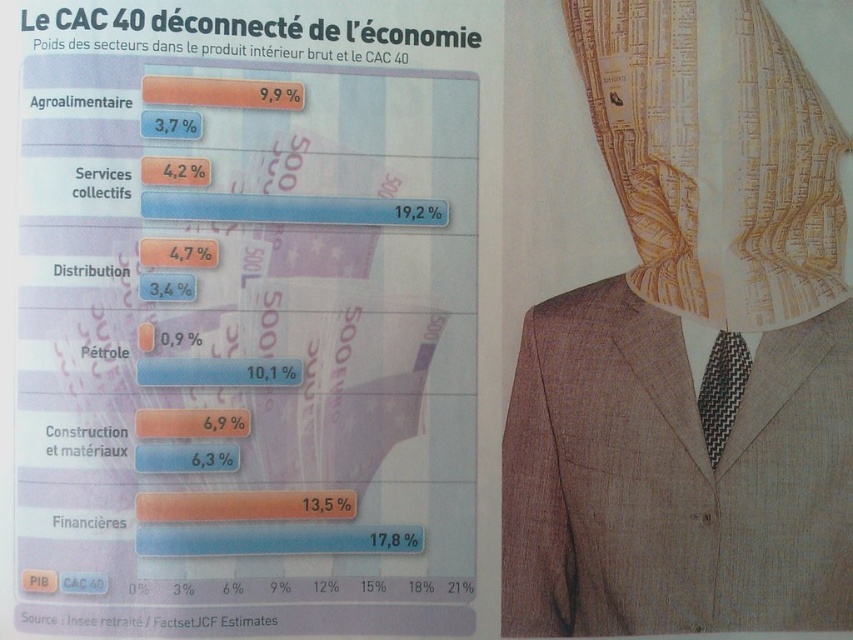
Is light brown textured suit at right closer to camera compared to black checkered tie at center?

Yes.

Between light brown textured suit at right and black checkered tie at center, which one appears on the left side from the viewer's perspective?

light brown textured suit at right

What do you see at coordinates (689, 348) in the screenshot? I see `light brown textured suit at right` at bounding box center [689, 348].

At what (x,y) coordinates should I click in order to perform the action: click on light brown textured suit at right. Please return your answer as a coordinate pair (x, y). Looking at the image, I should click on (689, 348).

Which is above, gold textured veil at upper right or black checkered tie at center?

Positioned higher is gold textured veil at upper right.

Does gold textured veil at upper right have a lesser width compared to black checkered tie at center?

In fact, gold textured veil at upper right might be wider than black checkered tie at center.

What do you see at coordinates (717, 157) in the screenshot? I see `gold textured veil at upper right` at bounding box center [717, 157].

This screenshot has width=853, height=640. What are the coordinates of `gold textured veil at upper right` in the screenshot? It's located at (717, 157).

Can you confirm if matte paper chart at upper left is positioned to the left of black checkered tie at center?

Correct, you'll find matte paper chart at upper left to the left of black checkered tie at center.

Does matte paper chart at upper left come behind black checkered tie at center?

No.

Describe the element at coordinates (250, 317) in the screenshot. I see `matte paper chart at upper left` at that location.

The width and height of the screenshot is (853, 640). Identify the location of matte paper chart at upper left. (250, 317).